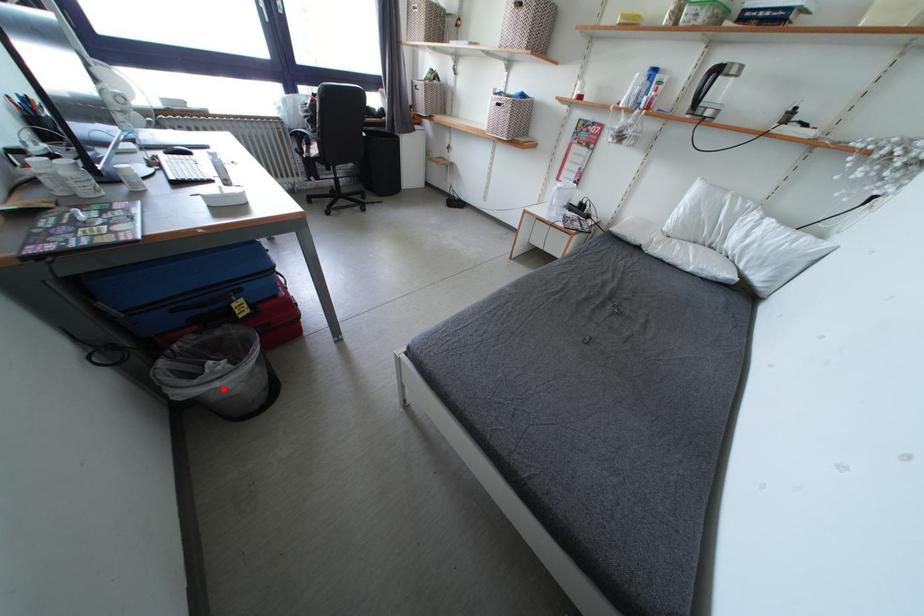
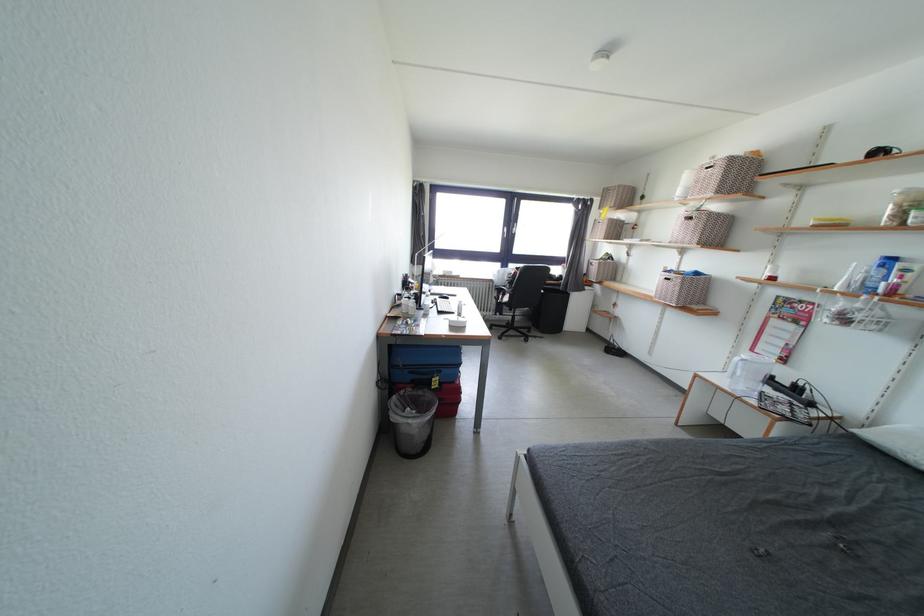
In the second image, find the point that corresponds to the highlighted location in the first image.

(417, 426)